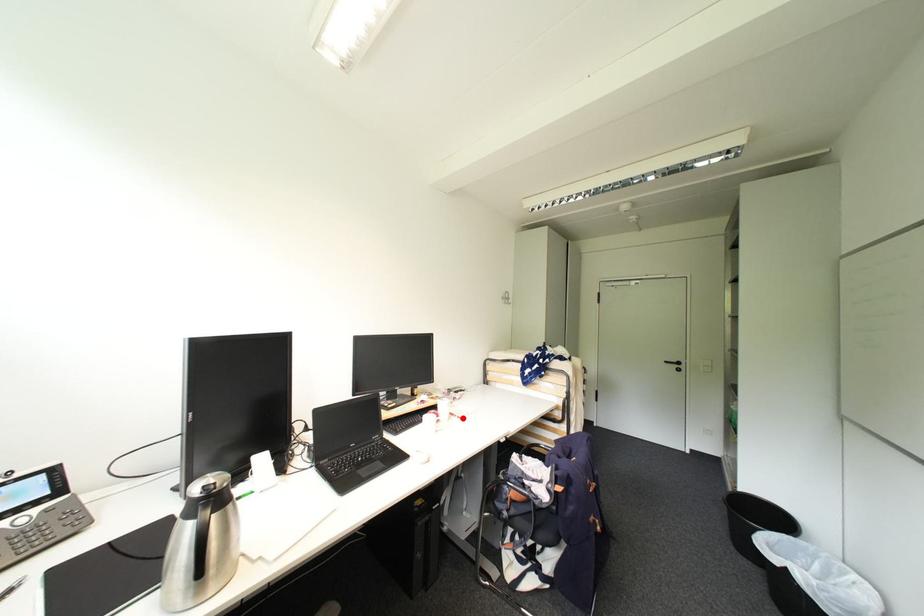
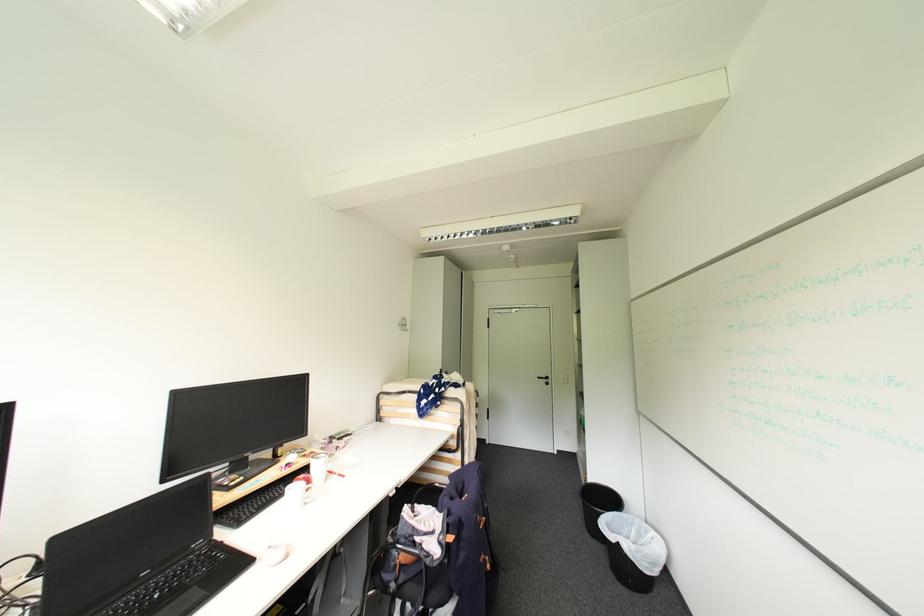
The point at the highlighted location is marked in the first image. Where is the corresponding point in the second image?

(343, 477)